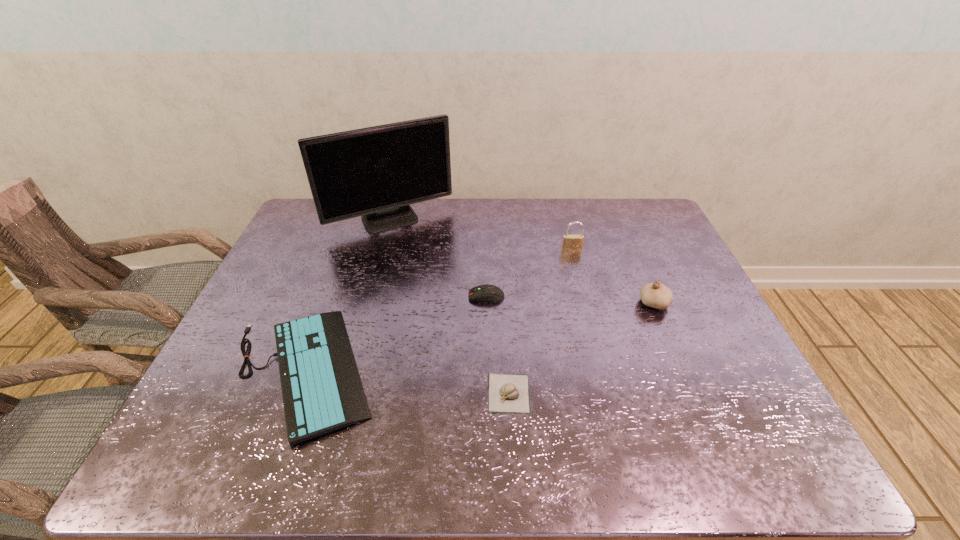
Where is `vacant point located between the taller garlic and the padlock`? The image size is (960, 540). vacant point located between the taller garlic and the padlock is located at coordinates (612, 276).

Find the location of a particular element. The width and height of the screenshot is (960, 540). free space between the second object from right to left and the computer equipment is located at coordinates (529, 273).

The height and width of the screenshot is (540, 960). In order to click on unoccupied area between the farthest object and the nearer garlic in this screenshot , I will do `click(450, 307)`.

Identify the location of free space between the computer equipment and the fifth shortest object. This screenshot has height=540, width=960. (529, 273).

The height and width of the screenshot is (540, 960). Find the location of `unoccupied position between the computer equipment and the farthest object`. unoccupied position between the computer equipment and the farthest object is located at coordinates (439, 259).

You are a GUI agent. You are given a task and a screenshot of the screen. Output one action in this format:
    pyautogui.click(x=<x>, y=<y>)
    Task: Click on the unoccupied position between the fourth shortest object and the nearer garlic
    This screenshot has height=540, width=960.
    Given the screenshot: What is the action you would take?
    581,348

The width and height of the screenshot is (960, 540). What are the coordinates of `blank region between the computer keyboard and the computer equipment` in the screenshot? It's located at (395, 333).

What are the coordinates of `empty location between the computer equipment and the computer keyboard` in the screenshot? It's located at (395, 333).

The width and height of the screenshot is (960, 540). Find the location of `unoccupied position between the tallest object and the computer keyboard`. unoccupied position between the tallest object and the computer keyboard is located at coordinates click(347, 296).

You are a GUI agent. You are given a task and a screenshot of the screen. Output one action in this format:
    pyautogui.click(x=<x>, y=<y>)
    Task: Click on the free space between the computer keyboard and the left garlic
    The image size is (960, 540).
    Given the screenshot: What is the action you would take?
    pyautogui.click(x=406, y=382)